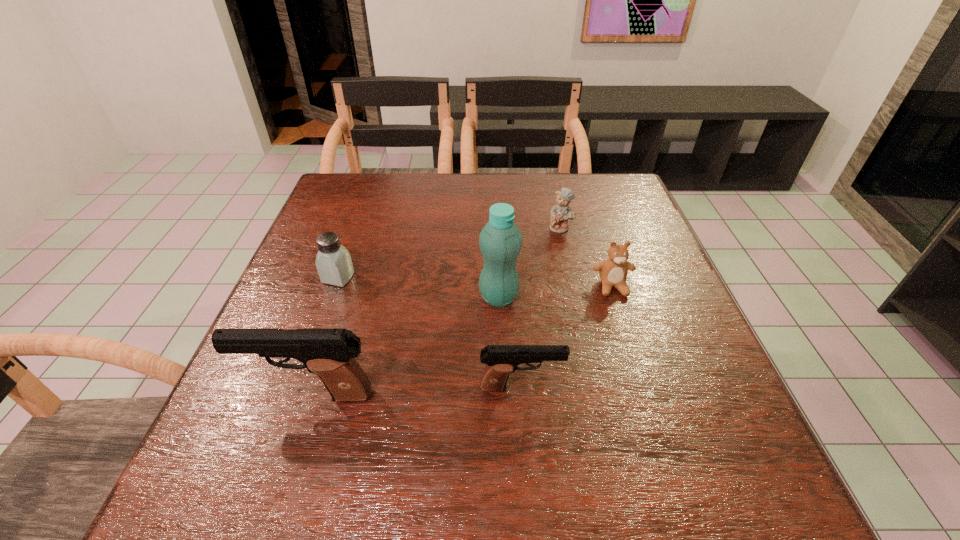
Where is `free space located 0.070m on the front-facing side of the fifth object from left to right`? The image size is (960, 540). free space located 0.070m on the front-facing side of the fifth object from left to right is located at coordinates (565, 251).

Find the location of a particular element. The image size is (960, 540). free space located 0.060m at the front cap of the water bottle is located at coordinates (500, 333).

I want to click on free space located 0.290m on the front of the saltshaker, so click(x=296, y=399).

At what (x,y) coordinates should I click in order to perform the action: click on vacant space located 0.170m on the front-facing side of the rightmost object. Please return your answer as a coordinate pair (x, y). This screenshot has height=540, width=960. Looking at the image, I should click on (636, 361).

This screenshot has width=960, height=540. In order to click on object present at the near edge in this screenshot , I will do `click(329, 353)`.

The height and width of the screenshot is (540, 960). In order to click on pistol that is at the left edge in this screenshot , I will do `click(329, 353)`.

Find the location of a particular element. This screenshot has height=540, width=960. saltshaker that is at the left edge is located at coordinates (333, 262).

Identify the location of object that is at the right edge. tap(613, 271).

Find the location of a particular element. The height and width of the screenshot is (540, 960). object located at the near left corner is located at coordinates 329,353.

The height and width of the screenshot is (540, 960). In order to click on vacant position at the far edge of the desktop in this screenshot , I will do `click(519, 183)`.